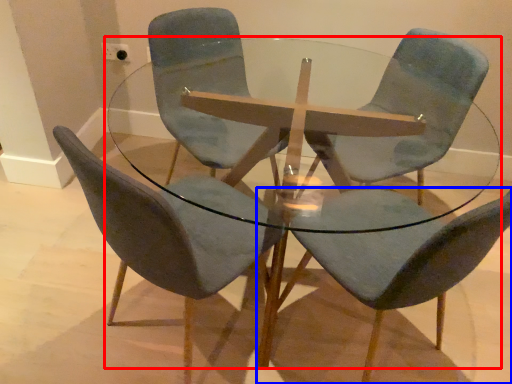
Question: Which of the following is the farthest to the observer, coffee table (highlighted by a red box) or chair (highlighted by a blue box)?

Choices:
 (A) coffee table
 (B) chair

Answer: (A)